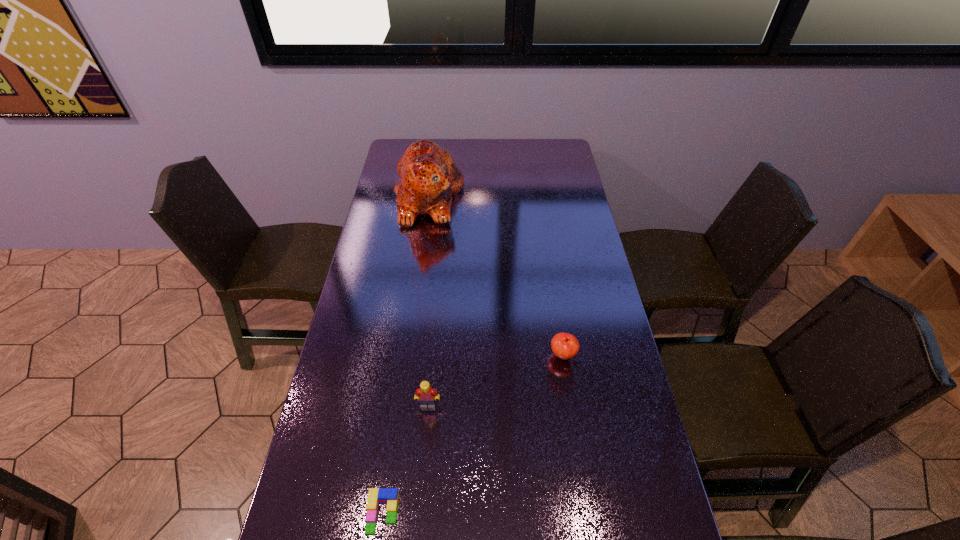
This screenshot has width=960, height=540. I want to click on vacant space in between the second farthest object and the nearest object, so click(473, 434).

Locate an element on the screen. This screenshot has height=540, width=960. empty space that is in between the right Lego and the cat is located at coordinates (428, 301).

This screenshot has width=960, height=540. I want to click on vacant space that's between the farther Lego and the farthest object, so click(428, 301).

The image size is (960, 540). What are the coordinates of `unoccupied position between the farthest object and the second shortest object` in the screenshot? It's located at (496, 276).

Where is `unoccupied area between the right Lego and the cat`? This screenshot has width=960, height=540. unoccupied area between the right Lego and the cat is located at coordinates (428, 301).

Identify the location of unoccupied area between the second tallest object and the rightmost object. The height and width of the screenshot is (540, 960). (495, 380).

Where is `empty location between the second nearest object and the third tallest object`? empty location between the second nearest object and the third tallest object is located at coordinates (495, 380).

You are a GUI agent. You are given a task and a screenshot of the screen. Output one action in this format:
    pyautogui.click(x=<x>, y=<y>)
    Task: Click on the vacant area that lies between the cat and the nearest object
    
    Given the screenshot: What is the action you would take?
    pyautogui.click(x=406, y=356)

You are a GUI agent. You are given a task and a screenshot of the screen. Output one action in this format:
    pyautogui.click(x=<x>, y=<y>)
    Task: Click on the object that is the closest to the nearest object
    The width and height of the screenshot is (960, 540).
    Given the screenshot: What is the action you would take?
    pyautogui.click(x=425, y=394)

Locate an element on the screen. This screenshot has width=960, height=540. object that stands as the third closest to the left Lego is located at coordinates (429, 179).